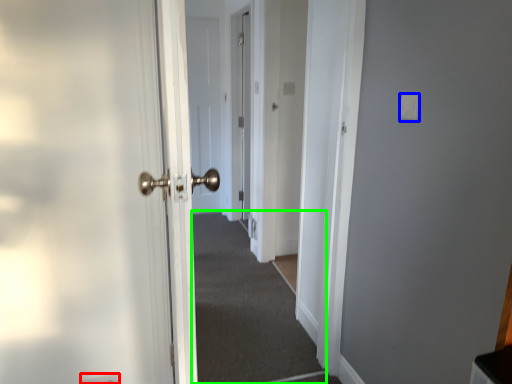
Question: Which object is positioned closest to electric outlet (highlighted by a red box)? Select from light switch (highlighted by a blue box) and corridor (highlighted by a green box).

Choices:
 (A) light switch
 (B) corridor

Answer: (B)